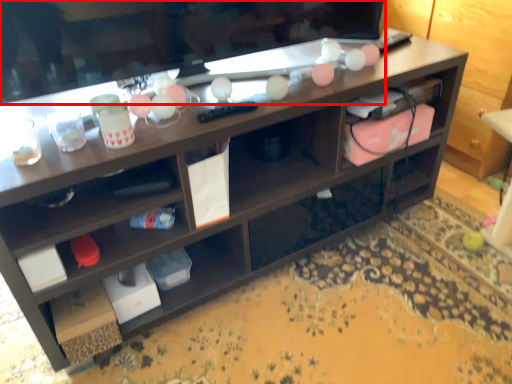
Question: Where is television (annotated by the red box) located in relation to cabinet in the image?

Choices:
 (A) right
 (B) left

Answer: (B)